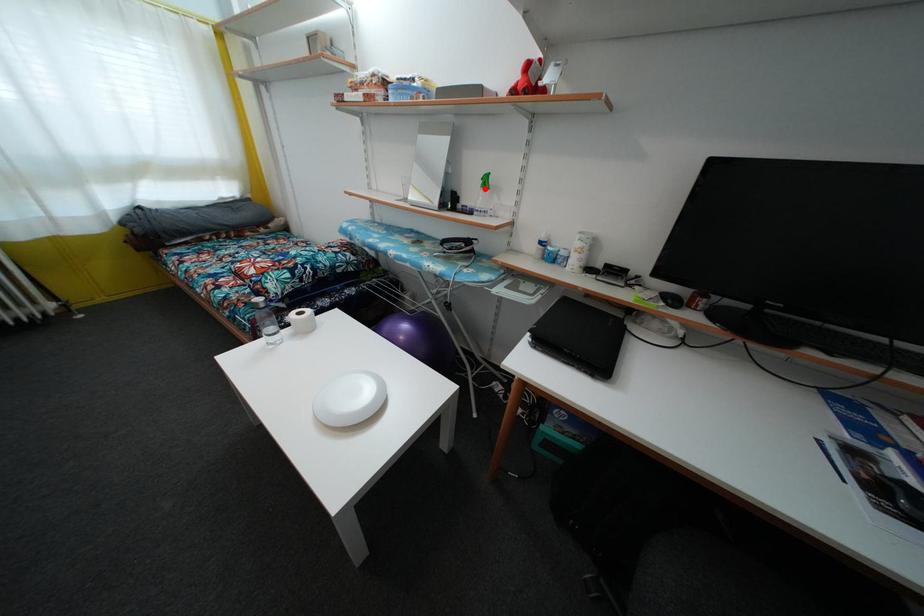
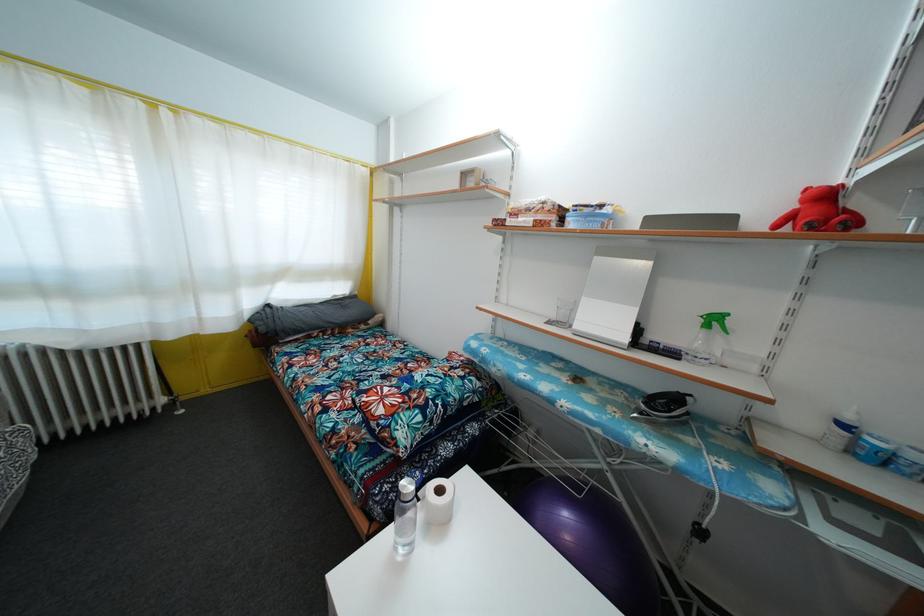
Question: I am providing you with two images of the same scene from different viewpoints. A red point is shown in image1. For the corresponding object point in image2, is it positioned nearer or farther from the camera?

Choices:
 (A) Nearer
 (B) Farther

Answer: (B)